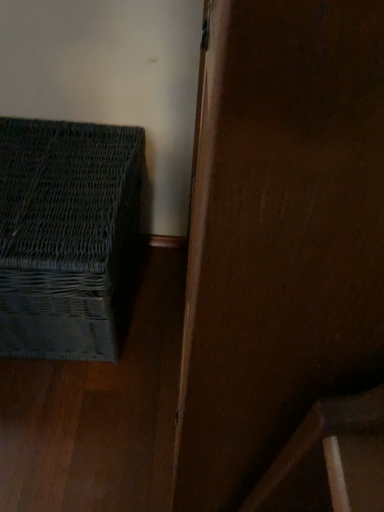
The width and height of the screenshot is (384, 512). What do you see at coordinates (65, 234) in the screenshot? I see `woven dark green basket at left` at bounding box center [65, 234].

At what (x,y) coordinates should I click in order to perform the action: click on woven dark green basket at left. Please return your answer as a coordinate pair (x, y). The image size is (384, 512). Looking at the image, I should click on (65, 234).

Locate an element on the screen. The image size is (384, 512). woven dark green basket at left is located at coordinates (65, 234).